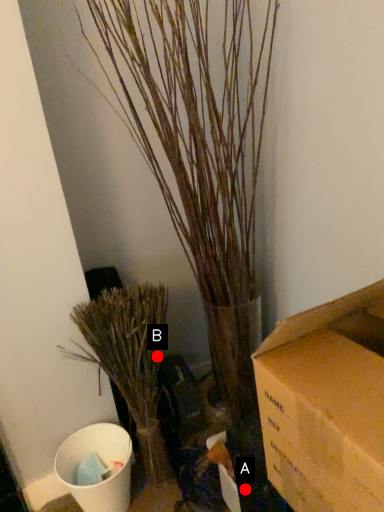
Question: Two points are circled on the image, labeled by A and B beside each circle. Which point is farther to the camera?

Choices:
 (A) A is further
 (B) B is further

Answer: (B)